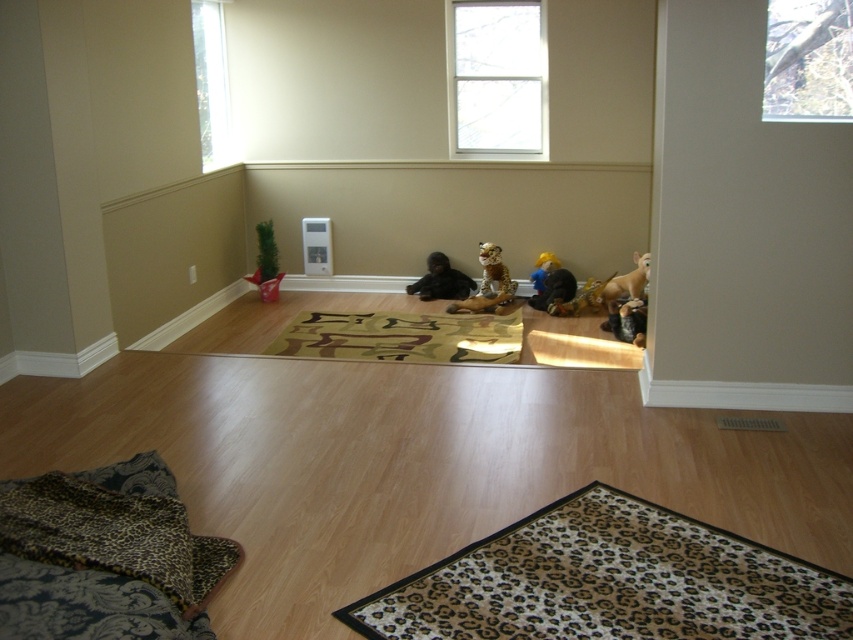
You are a cat sitting on the leopard print plush at center. You want to look outside through the transparent glass window at upper right. Can you see the window from your current position?

The transparent glass window at upper right is in front of leopard print plush at center, so yes, the cat can see the window from its current position on the leopard print plush at center.

You are sitting on the floor in the middle of the room and want to reach both the clear glass window at upper center and the green fabric plant at lower left. Which object is closer to your current position?

The green fabric plant at lower left is closer to your current position because it is located at lower left, while the clear glass window at upper center is positioned higher up and to the right, making it farther away.

You are organizing a childrens party and need to place two stuffed animals on a shelf. You have a leopard print plush at center and a plush yellow bear at center. Which one should you choose to place on the higher shelf to ensure visibility?

The leopard print plush at center is taller than the plush yellow bear at center, so placing it on the higher shelf will ensure better visibility.